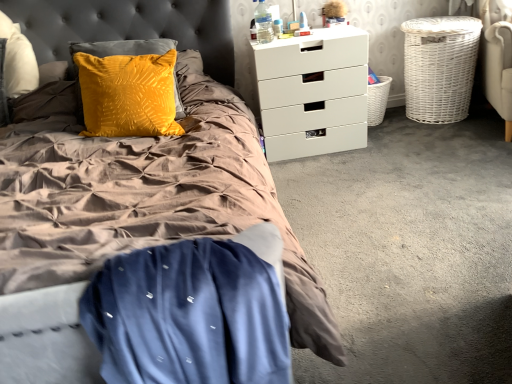
Locate an element on the screen. The height and width of the screenshot is (384, 512). velvet yellow pillow at upper left is located at coordinates (128, 27).

Measure the distance between point (258, 376) and camera.

The distance of point (258, 376) from camera is 66.80 centimeters.

What do you see at coordinates (377, 100) in the screenshot? I see `white wicker basket at lower right, which is the 1th basket from left to right` at bounding box center [377, 100].

Where is `white matte chest of drawers at upper right`? This screenshot has height=384, width=512. white matte chest of drawers at upper right is located at coordinates (312, 92).

Is velvet yellow pillow at upper left oriented towards white wicker basket at lower right, which is the 1th basket from left to right?

No, velvet yellow pillow at upper left is not oriented towards white wicker basket at lower right, which is the 1th basket from left to right.

Is point (208, 58) closer or farther from the camera than point (380, 76)?

Point (208, 58).

Considering the sizes of objects velvet yellow pillow at upper left and white wicker basket at lower right, which is the 1th basket from left to right, in the image provided, who is taller, velvet yellow pillow at upper left or white wicker basket at lower right, which is the 1th basket from left to right,?

velvet yellow pillow at upper left.

How much distance is there between velvet yellow pillow at upper left and white wicker basket at lower right, which ranks as the second basket in right-to-left order?

velvet yellow pillow at upper left and white wicker basket at lower right, which ranks as the second basket in right-to-left order, are 1.33 meters apart from each other.

Identify the location of bottle above the velvet yellow pillow at upper left (from a real-world perspective). (263, 23).

Is velvet yellow pillow at upper left surrounding clear plastic water bottle at upper right?

Definitely not — clear plastic water bottle at upper right is not inside velvet yellow pillow at upper left.

Considering the positions of objects velvet yellow pillow at upper left and clear plastic water bottle at upper right in the image provided, who is more to the left, velvet yellow pillow at upper left or clear plastic water bottle at upper right?

Positioned to the left is velvet yellow pillow at upper left.

Considering the positions of point (5, 7) and point (262, 37), is point (5, 7) closer or farther from the camera than point (262, 37)?

Point (5, 7).

Which is farther from the camera, (348, 137) or (184, 4)?

Point (348, 137)

Which object is positioned more to the left, white matte chest of drawers at upper right or velvet yellow pillow at upper left?

velvet yellow pillow at upper left is more to the left.

How different are the orientations of white matte chest of drawers at upper right and velvet yellow pillow at upper left in degrees?

The facing directions of white matte chest of drawers at upper right and velvet yellow pillow at upper left are 1.29 degrees apart.

Could velvet yellow pillow at upper left be considered to be inside white matte chest of drawers at upper right?

No, white matte chest of drawers at upper right does not contain velvet yellow pillow at upper left.

Which of these two, blue satin blanket at lower left or velvet mustard pillow at upper left, is smaller?

With smaller size is blue satin blanket at lower left.

Considering the sizes of objects blue satin blanket at lower left and velvet mustard pillow at upper left in the image provided, who is wider, blue satin blanket at lower left or velvet mustard pillow at upper left?

velvet mustard pillow at upper left.

Is velvet mustard pillow at upper left located within blue satin blanket at lower left?

Actually, velvet mustard pillow at upper left is outside blue satin blanket at lower left.

From a real-world perspective, is blue satin blanket at lower left positioned under velvet mustard pillow at upper left based on gravity?

Yes, from a real-world perspective, blue satin blanket at lower left is below velvet mustard pillow at upper left.

From a real-world perspective, which object stands above the other?

In real-world perspective, white matte chest of drawers at upper right is above.

Does white matte chest of drawers at upper right lie in front of white wicker basket at lower right, which ranks as the second basket in right-to-left order?

Yes.

Is point (267, 138) positioned behind point (368, 118)?

No, (267, 138) is in front of (368, 118).

Is white matte chest of drawers at upper right at the left side of white wicker basket at lower right, which ranks as the second basket in right-to-left order?

Yes.

Find the location of `bottle lying on the left of white wicker basket at right, positioned as the first basket in right-to-left order`. bottle lying on the left of white wicker basket at right, positioned as the first basket in right-to-left order is located at coordinates (263, 23).

Which is further, (426,56) or (260,40)?

The point (426,56) is farther.

Between white wicker basket at right, which appears as the second basket when viewed from the left, and clear plastic water bottle at upper right, which one has smaller size?

Smaller between the two is clear plastic water bottle at upper right.

What's the angular difference between white wicker basket at lower right, which is the 1th basket from left to right, and velvet yellow pillow at upper left's facing directions?

They differ by 1.29 degrees in their facing directions.

Consider the image. Is white wicker basket at lower right, which ranks as the second basket in right-to-left order, positioned with its back to velvet yellow pillow at upper left?

white wicker basket at lower right, which ranks as the second basket in right-to-left order, does not have its back to velvet yellow pillow at upper left.

Consider the image. Does white wicker basket at lower right, which ranks as the second basket in right-to-left order, have a greater width compared to velvet yellow pillow at upper left?

No, white wicker basket at lower right, which ranks as the second basket in right-to-left order, is not wider than velvet yellow pillow at upper left.

From a real-world perspective, is white wicker basket at lower right, which ranks as the second basket in right-to-left order, beneath velvet yellow pillow at upper left?

Yes, from a real-world perspective, white wicker basket at lower right, which ranks as the second basket in right-to-left order, is under velvet yellow pillow at upper left.

Where is `headboard above the white wicker basket at lower right, which ranks as the second basket in right-to-left order (from the image's perspective)`? headboard above the white wicker basket at lower right, which ranks as the second basket in right-to-left order (from the image's perspective) is located at coordinates (128, 27).

The image size is (512, 384). What are the coordinates of `bottle behind the velvet yellow pillow at upper left` in the screenshot? It's located at (263, 23).

When comparing their distances from velvet mustard pillow at upper left, does velvet yellow pillow at upper left or white wicker basket at lower right, which ranks as the second basket in right-to-left order, seem closer?

Among the two, velvet yellow pillow at upper left is located nearer to velvet mustard pillow at upper left.

When comparing their distances from velvet yellow pillow at upper left, does white matte chest of drawers at upper right or white wicker basket at lower right, which is the 1th basket from left to right, seem further?

white wicker basket at lower right, which is the 1th basket from left to right, is further to velvet yellow pillow at upper left.

Based on their spatial positions, is blue satin blanket at lower left or clear plastic water bottle at upper right closer to white wicker basket at lower right, which is the 1th basket from left to right?

clear plastic water bottle at upper right.

When comparing their distances from blue satin blanket at lower left, does white wicker basket at lower right, which is the 1th basket from left to right, or velvet yellow pillow at upper left seem closer?

velvet yellow pillow at upper left is positioned closer to the anchor blue satin blanket at lower left.

Considering their positions, is white wicker basket at right, which appears as the second basket when viewed from the left, positioned closer to white matte chest of drawers at upper right than velvet mustard pillow at upper left?

velvet mustard pillow at upper left lies closer to white matte chest of drawers at upper right than the other object.

When comparing their distances from blue satin blanket at lower left, does velvet yellow pillow at upper left or velvet mustard pillow at upper left seem further?

The object further to blue satin blanket at lower left is velvet yellow pillow at upper left.

When comparing their distances from white matte chest of drawers at upper right, does blue satin blanket at lower left or velvet mustard pillow at upper left seem further?

blue satin blanket at lower left lies further to white matte chest of drawers at upper right than the other object.

Based on their spatial positions, is velvet yellow pillow at upper left or clear plastic water bottle at upper right closer to white matte chest of drawers at upper right?

Among the two, clear plastic water bottle at upper right is located nearer to white matte chest of drawers at upper right.

The width and height of the screenshot is (512, 384). Identify the location of headboard between blue satin blanket at lower left and white wicker basket at lower right, which is the 1th basket from left to right, in the front-back direction. (128, 27).

The height and width of the screenshot is (384, 512). I want to click on chest of drawers between velvet yellow pillow at upper left and white wicker basket at right, positioned as the first basket in right-to-left order, so click(x=312, y=92).

Locate an element on the screen. The image size is (512, 384). the chest of drawers positioned between velvet mustard pillow at upper left and clear plastic water bottle at upper right from near to far is located at coordinates (312, 92).

You are a GUI agent. You are given a task and a screenshot of the screen. Output one action in this format:
    pyautogui.click(x=<x>, y=<y>)
    Task: Click on the bottle located between velvet mustard pillow at upper left and white wicker basket at right, positioned as the first basket in right-to-left order, in the depth direction
    The height and width of the screenshot is (384, 512).
    Given the screenshot: What is the action you would take?
    pyautogui.click(x=263, y=23)